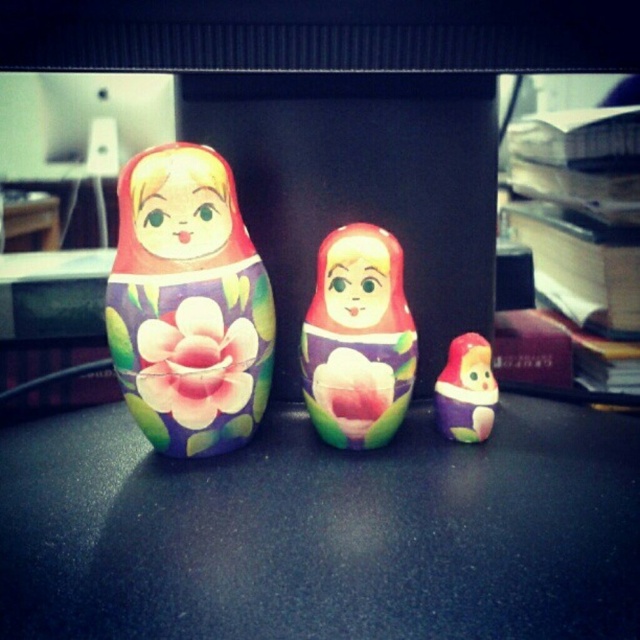
Based on the photo, you are looking at the three matryoshka dolls arranged on the table. There are two specific points marked on the dolls. The first point is at coordinate (545, 524) and the second is at (387, 243). Which of these points is nearer to you as you observe the dolls from the front?

Point (545, 524) is closer to the camera than point (387, 243).

You are standing in a room where the image is displayed. The matte black table at center is located at coordinates point 0.831, 0.506. If you want to place a new object exactly where the table is, where should you place it?

You should place the new object at the coordinates point (323, 531) where the matte black table at center is located.

Consider the image. You have a small toy car that is 3 inches long. You want to drive it from the matte black table at center to the matte painted doll at center. Is there enough space for the toy car to move between them?

The matte black table at center and matte painted doll at center are 7.42 inches apart, so yes, the toy car can move between them since the distance is greater than the car length.